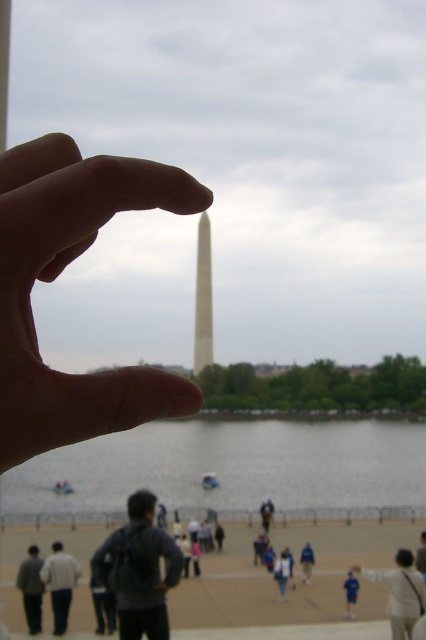
You are a photographer who wants to capture the monument in the background while ensuring the dark gray backpack at center is in focus. Based on the scene description, where should you position the backpack relative to the monument to maintain both in focus?

The dark gray backpack at center is positioned at point (x=138, y=570), so to keep both the monument and the backpack in focus, the backpack should be placed at that coordinate, ensuring it is within the depth of field of the camera lens.

Based on the photo, you are a photographer who wants to capture the white marble obelisk at center without any obstructions. Given the current setup with the smooth skin hand at center, is it possible to adjust your position to frame the obelisk clearly?

The smooth skin hand at center is in front of the white marble obelisk at center. To frame the obelisk clearly, you can move your camera position so that the hand is no longer blocking the view. Alternatively, you could ask the person to move their hand, ensuring the obelisk remains the focal point without obstruction.

You are standing in front of the monument and want to take a photo of the clear water at lower center. Based on its position, where should you aim your camera?

The clear water at lower center is located at point (232, 470), so you should aim your camera towards that coordinate to capture it properly.